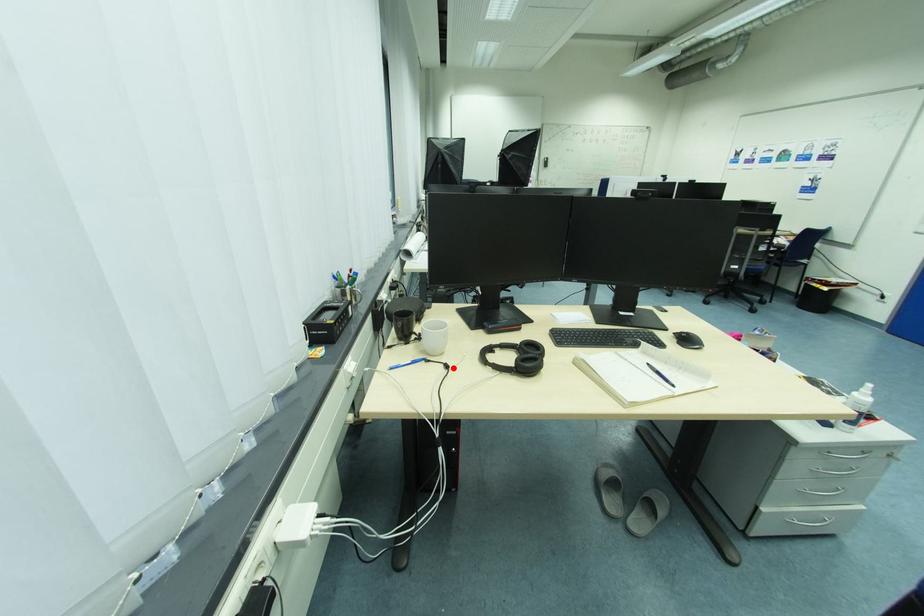
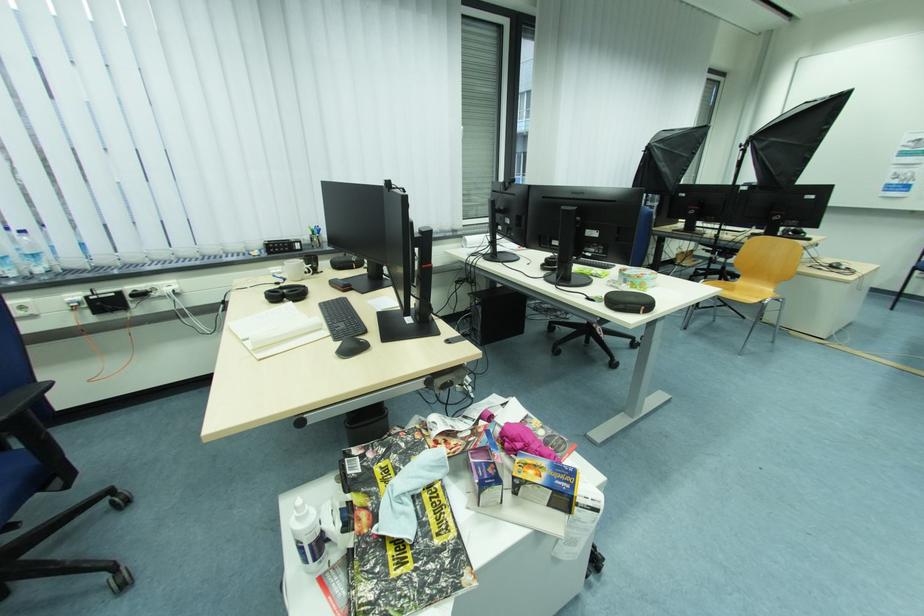
The point at the highlighted location is marked in the first image. Where is the corresponding point in the second image?

(284, 285)